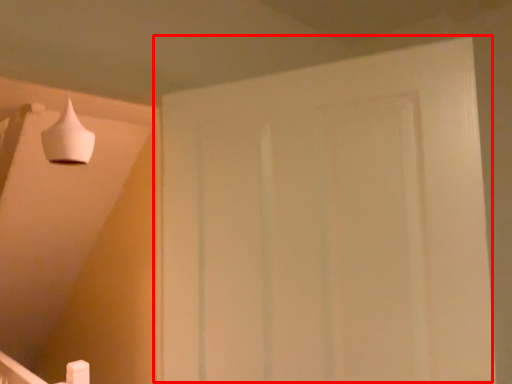
Question: In this image, where is door (annotated by the red box) located relative to lamp?

Choices:
 (A) left
 (B) right

Answer: (B)